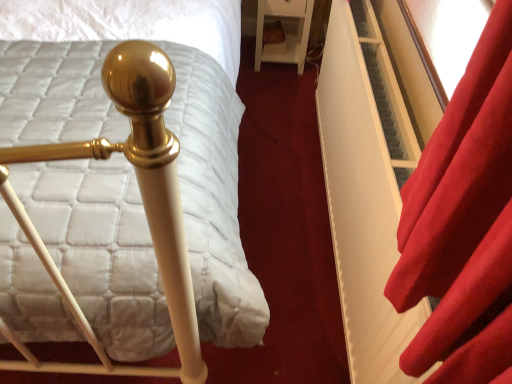
Where is `white matte bed frame at center`? white matte bed frame at center is located at coordinates (366, 188).

This screenshot has height=384, width=512. Identify the location of white glossy nightstand at upper right. 286,32.

What is the approximate height of velvet red curtain at right?

It is 2.40 inches.

The width and height of the screenshot is (512, 384). I want to click on white matte bed frame at center, so (x=366, y=188).

Can you confirm if white quilted mattress at center is positioned to the left of white glossy nightstand at upper right?

Yes.

Does white quilted mattress at center have a lesser height compared to white glossy nightstand at upper right?

In fact, white quilted mattress at center may be taller than white glossy nightstand at upper right.

Is point (56, 303) farther from camera compared to point (298, 17)?

No, (56, 303) is in front of (298, 17).

Looking at this image, how distant is white quilted mattress at center from white glossy nightstand at upper right?

A distance of 4.05 feet exists between white quilted mattress at center and white glossy nightstand at upper right.

This screenshot has width=512, height=384. I want to click on curtain above the white matte bed frame at center (from the image's perspective), so click(463, 224).

Between white matte bed frame at center and velvet red curtain at right, which one has smaller width?

Thinner between the two is white matte bed frame at center.

From the image's perspective, which is above, white matte bed frame at center or velvet red curtain at right?

From the image's view, velvet red curtain at right is above.

What's the angular difference between white matte bed frame at center and velvet red curtain at right's facing directions?

The facing directions of white matte bed frame at center and velvet red curtain at right are 1.17 degrees apart.

Is velvet red curtain at right looking in the opposite direction of white quilted mattress at center?

No, velvet red curtain at right is not facing away from white quilted mattress at center.

Which of these two, velvet red curtain at right or white quilted mattress at center, is bigger?

With larger size is white quilted mattress at center.

From a real-world perspective, is velvet red curtain at right physically above white quilted mattress at center?

Indeed, from a real-world perspective, velvet red curtain at right stands above white quilted mattress at center.

From the image's perspective, is white glossy nightstand at upper right above or below white quilted mattress at center?

Clearly, from the image's perspective, white glossy nightstand at upper right is above white quilted mattress at center.

Between white glossy nightstand at upper right and white quilted mattress at center, which one is positioned in front?

white quilted mattress at center is in front.

How much distance is there between white glossy nightstand at upper right and white quilted mattress at center?

The distance of white glossy nightstand at upper right from white quilted mattress at center is 4.05 feet.

What's the angular difference between velvet red curtain at right and white matte bed frame at center's facing directions?

1.17 degrees separate the facing orientations of velvet red curtain at right and white matte bed frame at center.

Considering the positions of objects velvet red curtain at right and white matte bed frame at center in the image provided, who is more to the left, velvet red curtain at right or white matte bed frame at center?

From the viewer's perspective, white matte bed frame at center appears more on the left side.

Could you tell me if velvet red curtain at right is turned towards white matte bed frame at center?

No, velvet red curtain at right is not aimed at white matte bed frame at center.

Can we say velvet red curtain at right lies outside white matte bed frame at center?

That's correct, velvet red curtain at right is outside of white matte bed frame at center.

From the image's perspective, is white quilted mattress at center below white matte bed frame at center?

No, from the image's perspective, white quilted mattress at center is not beneath white matte bed frame at center.

Which object is more forward, white quilted mattress at center or white matte bed frame at center?

Positioned in front is white quilted mattress at center.

From a real-world perspective, which object stands above the other?

white quilted mattress at center is physically above.

Find the location of a particular element. Image resolution: width=512 pixels, height=384 pixels. curtain positioned vertically above the white glossy nightstand at upper right (from a real-world perspective) is located at coordinates click(463, 224).

Looking at this image, which is less distant, (487, 299) or (277, 0)?

The point (487, 299) is closer to the camera.

In the scene shown: Considering the sizes of objects velvet red curtain at right and white glossy nightstand at upper right in the image provided, who is smaller, velvet red curtain at right or white glossy nightstand at upper right?

velvet red curtain at right.

Can we say velvet red curtain at right lies outside white glossy nightstand at upper right?

velvet red curtain at right lies outside white glossy nightstand at upper right's area.

This screenshot has width=512, height=384. Identify the location of furniture directly beneath the white quilted mattress at center (from a real-world perspective). (286, 32).

Identify the location of bed frame lying below the velvet red curtain at right (from the image's perspective). The image size is (512, 384). [x=366, y=188].

Looking at the image, which one is located closer to white glossy nightstand at upper right, white matte bed frame at center or velvet red curtain at right?

white matte bed frame at center is closer to white glossy nightstand at upper right.

When comparing their distances from white quilted mattress at center, does white matte bed frame at center or velvet red curtain at right seem further?

velvet red curtain at right.

Consider the image. Considering their positions, is white glossy nightstand at upper right positioned closer to velvet red curtain at right than white matte bed frame at center?

The object closer to velvet red curtain at right is white matte bed frame at center.

Estimate the real-world distances between objects in this image. Which object is closer to white quilted mattress at center, white matte bed frame at center or white glossy nightstand at upper right?

Based on the image, white matte bed frame at center appears to be nearer to white quilted mattress at center.

Looking at the image, which one is located further to velvet red curtain at right, white matte bed frame at center or white quilted mattress at center?

The object further to velvet red curtain at right is white quilted mattress at center.

From the image, which object appears to be farther from white glossy nightstand at upper right, white quilted mattress at center or velvet red curtain at right?

velvet red curtain at right is further to white glossy nightstand at upper right.

Based on the photo, which object lies further to the anchor point white quilted mattress at center, velvet red curtain at right or white matte bed frame at center?

Based on the image, velvet red curtain at right appears to be further to white quilted mattress at center.

Considering their positions, is white matte bed frame at center positioned further to velvet red curtain at right than white glossy nightstand at upper right?

The object further to velvet red curtain at right is white glossy nightstand at upper right.

Locate an element on the screen. This screenshot has height=384, width=512. bed frame between white quilted mattress at center and velvet red curtain at right is located at coordinates (366, 188).

Where is `bed frame between velvet red curtain at right and white glossy nightstand at upper right in the front-back direction`? The height and width of the screenshot is (384, 512). bed frame between velvet red curtain at right and white glossy nightstand at upper right in the front-back direction is located at coordinates (366, 188).

Where is `bed frame located between white quilted mattress at center and white glossy nightstand at upper right in the depth direction`? This screenshot has width=512, height=384. bed frame located between white quilted mattress at center and white glossy nightstand at upper right in the depth direction is located at coordinates (366, 188).

I want to click on curtain between white quilted mattress at center and white glossy nightstand at upper right in the front-back direction, so click(x=463, y=224).